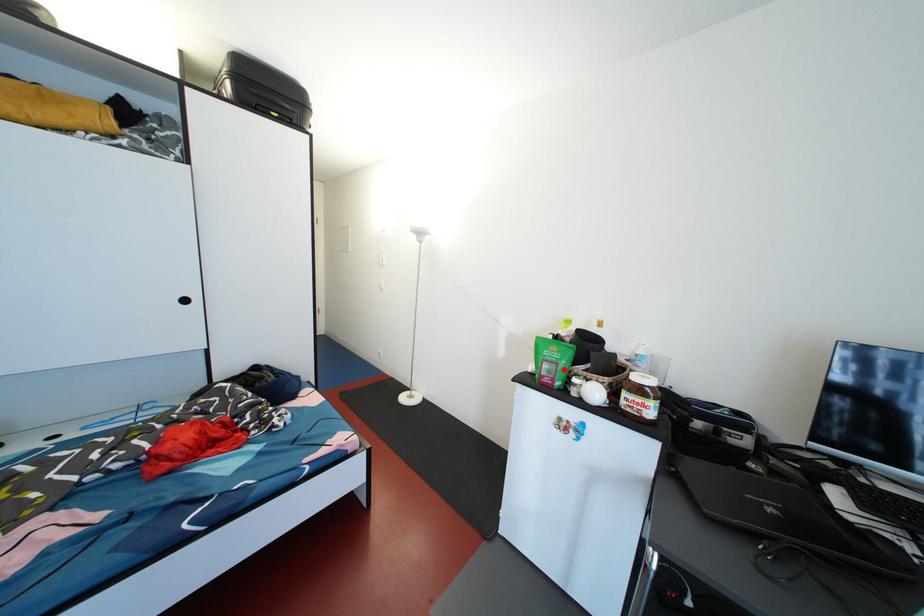
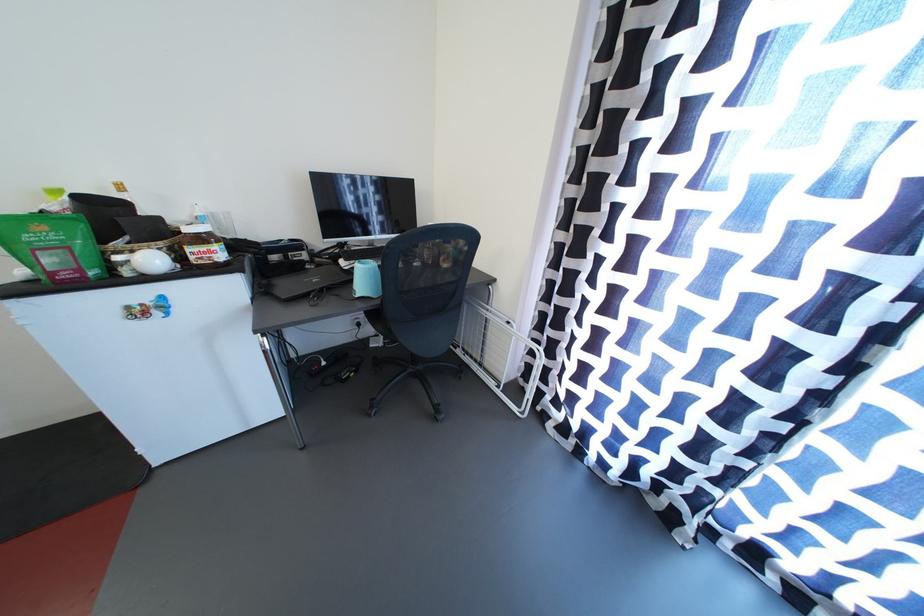
In the second image, find the point that corresponds to the highlighted location in the first image.

(75, 253)